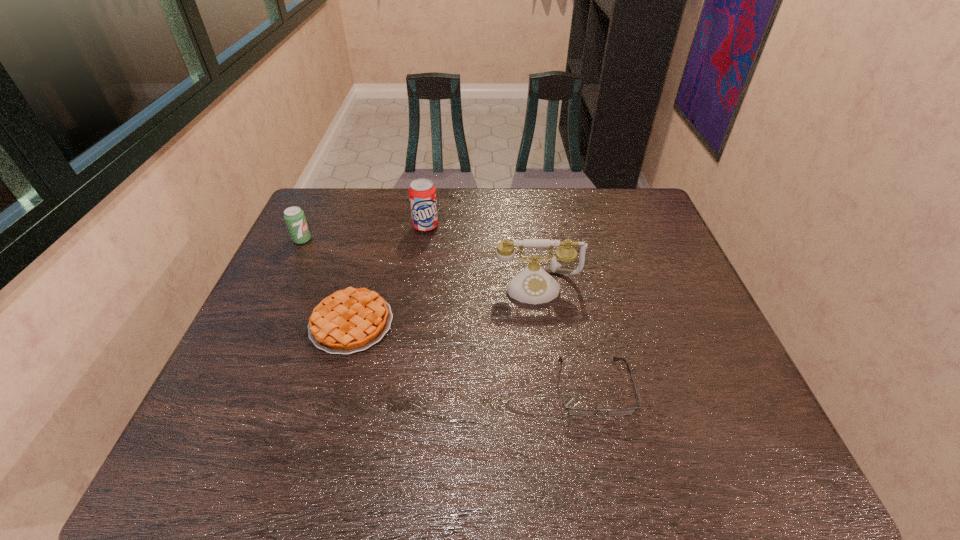
At what (x,y) coordinates should I click in order to perform the action: click on vacant point located between the third object from right to left and the telephone. Please return your answer as a coordinate pair (x, y). Image resolution: width=960 pixels, height=540 pixels. Looking at the image, I should click on (482, 256).

Locate which object is the fourth closest to the telephone. Please provide its 2D coordinates. Your answer should be formatted as a tuple, i.e. [(x, y)], where the tuple contains the x and y coordinates of a point satisfying the conditions above.

[(295, 219)]

You are a GUI agent. You are given a task and a screenshot of the screen. Output one action in this format:
    pyautogui.click(x=<x>, y=<y>)
    Task: Click on the object that is the second nearest to the spectacles
    The height and width of the screenshot is (540, 960).
    Given the screenshot: What is the action you would take?
    pyautogui.click(x=351, y=320)